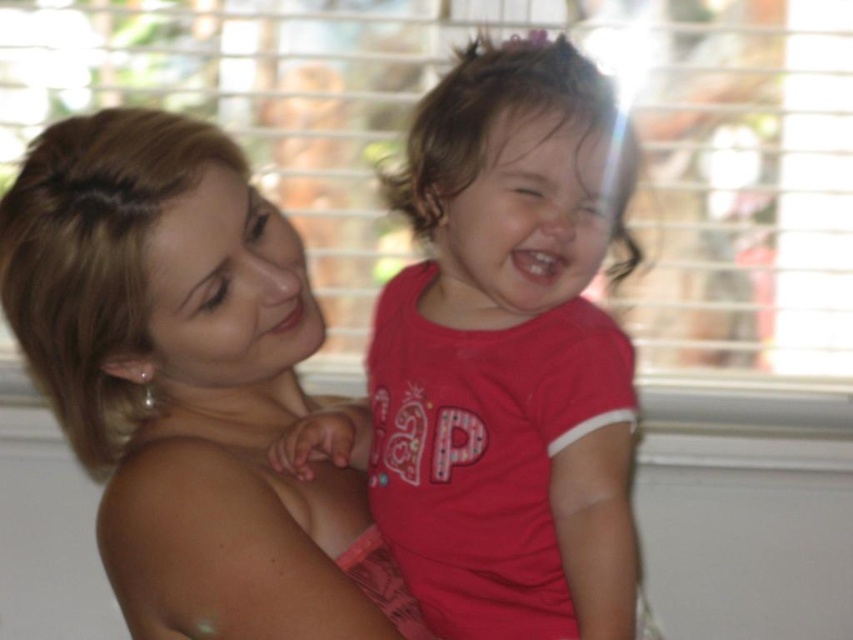
Looking at this image, you are a photographer trying to capture a closeup of the smooth blonde hair at left without the pink matte shirt at center appearing in the shot. Is this possible given their positions?

The smooth blonde hair at left is behind the pink matte shirt at center, so you cannot capture a closeup of the smooth blonde hair at left without the pink matte shirt at center appearing in the shot.